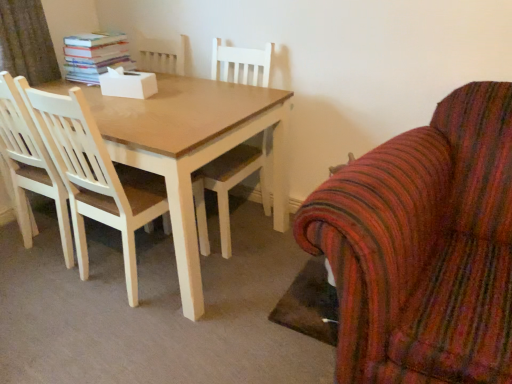
Measure the distance between point (x=388, y=314) and camera.

The depth of point (x=388, y=314) is 3.65 feet.

This screenshot has width=512, height=384. What do you see at coordinates (95, 55) in the screenshot?
I see `hardcover books at upper left` at bounding box center [95, 55].

What are the coordinates of `striped fabric armchair at right, the second chair when ordered from left to right` in the screenshot? It's located at (424, 247).

Is light wood chair at left, which is the 2th chair from right to left, further to the viewer compared to hardcover books at upper left?

That is False.

From a real-world perspective, is light wood chair at left, which is the 2th chair from right to left, located higher than hardcover books at upper left?

No, from a real-world perspective, light wood chair at left, which is the 2th chair from right to left, is not on top of hardcover books at upper left.

Could you tell me if light wood chair at left, positioned as the 1th chair in left-to-right order, is turned towards hardcover books at upper left?

No, light wood chair at left, positioned as the 1th chair in left-to-right order, is not aimed at hardcover books at upper left.

Which of these two, light wood chair at left, which is the 2th chair from right to left, or hardcover books at upper left, stands taller?

light wood chair at left, which is the 2th chair from right to left, is taller.

Considering the sizes of light wood chair at left, positioned as the 1th chair in left-to-right order, and striped fabric armchair at right, marked as the 1th chair in a right-to-left arrangement, in the image, is light wood chair at left, positioned as the 1th chair in left-to-right order, wider or thinner than striped fabric armchair at right, marked as the 1th chair in a right-to-left arrangement,?

light wood chair at left, positioned as the 1th chair in left-to-right order, is thinner than striped fabric armchair at right, marked as the 1th chair in a right-to-left arrangement.

Is light wood chair at left, which is the 2th chair from right to left, inside the boundaries of striped fabric armchair at right, the second chair when ordered from left to right, or outside?

light wood chair at left, which is the 2th chair from right to left, is outside striped fabric armchair at right, the second chair when ordered from left to right.

Which point is more forward, (128, 187) or (407, 262)?

Point (407, 262)

Is hardcover books at upper left located outside striped fabric armchair at right, the second chair when ordered from left to right?

Yes, hardcover books at upper left is located beyond the bounds of striped fabric armchair at right, the second chair when ordered from left to right.

Considering the sizes of objects hardcover books at upper left and striped fabric armchair at right, the second chair when ordered from left to right, in the image provided, who is bigger, hardcover books at upper left or striped fabric armchair at right, the second chair when ordered from left to right,?

striped fabric armchair at right, the second chair when ordered from left to right, is bigger.

Is hardcover books at upper left wider than striped fabric armchair at right, the second chair when ordered from left to right?

No, hardcover books at upper left is not wider than striped fabric armchair at right, the second chair when ordered from left to right.

From the image's perspective, is hardcover books at upper left located beneath light wood chair at left, positioned as the 1th chair in left-to-right order?

No.

Which object is positioned more to the right, hardcover books at upper left or light wood chair at left, positioned as the 1th chair in left-to-right order?

light wood chair at left, positioned as the 1th chair in left-to-right order.

Consider the image. Can you tell me how much hardcover books at upper left and light wood chair at left, positioned as the 1th chair in left-to-right order, differ in facing direction?

The facing directions of hardcover books at upper left and light wood chair at left, positioned as the 1th chair in left-to-right order, are 88.4 degrees apart.

Is hardcover books at upper left taller or shorter than light wood chair at left, which is the 2th chair from right to left?

hardcover books at upper left is shorter than light wood chair at left, which is the 2th chair from right to left.

Is striped fabric armchair at right, the second chair when ordered from left to right, wider or thinner than light wood chair at left, positioned as the 1th chair in left-to-right order?

Clearly, striped fabric armchair at right, the second chair when ordered from left to right, has more width compared to light wood chair at left, positioned as the 1th chair in left-to-right order.

In the scene shown: From the image's perspective, which one is positioned higher, striped fabric armchair at right, the second chair when ordered from left to right, or light wood chair at left, positioned as the 1th chair in left-to-right order?

light wood chair at left, positioned as the 1th chair in left-to-right order, appears higher in the image.

Considering the positions of objects striped fabric armchair at right, the second chair when ordered from left to right, and light wood chair at left, positioned as the 1th chair in left-to-right order, in the image provided, who is more to the left, striped fabric armchair at right, the second chair when ordered from left to right, or light wood chair at left, positioned as the 1th chair in left-to-right order,?

light wood chair at left, positioned as the 1th chair in left-to-right order.

Is striped fabric armchair at right, the second chair when ordered from left to right, in front of or behind light wood chair at left, which is the 2th chair from right to left, in the image?

Clearly, striped fabric armchair at right, the second chair when ordered from left to right, is in front of light wood chair at left, which is the 2th chair from right to left.

Could you tell me if striped fabric armchair at right, marked as the 1th chair in a right-to-left arrangement, is turned towards hardcover books at upper left?

No.

Considering the sizes of objects striped fabric armchair at right, marked as the 1th chair in a right-to-left arrangement, and hardcover books at upper left in the image provided, who is smaller, striped fabric armchair at right, marked as the 1th chair in a right-to-left arrangement, or hardcover books at upper left?

With smaller size is hardcover books at upper left.

Which object is further away from the camera, striped fabric armchair at right, the second chair when ordered from left to right, or hardcover books at upper left?

hardcover books at upper left is more distant.

Find the location of a particular element. The image size is (512, 384). book above the light wood chair at left, positioned as the 1th chair in left-to-right order (from the image's perspective) is located at coordinates (95, 55).

The width and height of the screenshot is (512, 384). Identify the location of chair in front of the light wood chair at left, which is the 2th chair from right to left. (424, 247).

Based on their spatial positions, is hardcover books at upper left or light wood chair at left, positioned as the 1th chair in left-to-right order, closer to striped fabric armchair at right, the second chair when ordered from left to right?

Among the two, light wood chair at left, positioned as the 1th chair in left-to-right order, is located nearer to striped fabric armchair at right, the second chair when ordered from left to right.

Based on their spatial positions, is light wood chair at left, which is the 2th chair from right to left, or hardcover books at upper left further from striped fabric armchair at right, marked as the 1th chair in a right-to-left arrangement?

hardcover books at upper left lies further to striped fabric armchair at right, marked as the 1th chair in a right-to-left arrangement, than the other object.

Which object lies nearer to the anchor point light wood chair at left, which is the 2th chair from right to left, striped fabric armchair at right, marked as the 1th chair in a right-to-left arrangement, or hardcover books at upper left?

Among the two, hardcover books at upper left is located nearer to light wood chair at left, which is the 2th chair from right to left.

From the image, which object appears to be farther from hardcover books at upper left, striped fabric armchair at right, the second chair when ordered from left to right, or light wood chair at left, which is the 2th chair from right to left?

Based on the image, striped fabric armchair at right, the second chair when ordered from left to right, appears to be further to hardcover books at upper left.

Based on their spatial positions, is hardcover books at upper left or striped fabric armchair at right, marked as the 1th chair in a right-to-left arrangement, further from light wood chair at left, positioned as the 1th chair in left-to-right order?

Based on the image, striped fabric armchair at right, marked as the 1th chair in a right-to-left arrangement, appears to be further to light wood chair at left, positioned as the 1th chair in left-to-right order.

Based on their spatial positions, is light wood chair at left, which is the 2th chair from right to left, or striped fabric armchair at right, marked as the 1th chair in a right-to-left arrangement, closer to hardcover books at upper left?

light wood chair at left, which is the 2th chair from right to left.

You are a GUI agent. You are given a task and a screenshot of the screen. Output one action in this format:
    pyautogui.click(x=<x>, y=<y>)
    Task: Click on the chair between hardcover books at upper left and striped fabric armchair at right, the second chair when ordered from left to right
    This screenshot has height=384, width=512.
    Given the screenshot: What is the action you would take?
    pyautogui.click(x=94, y=176)